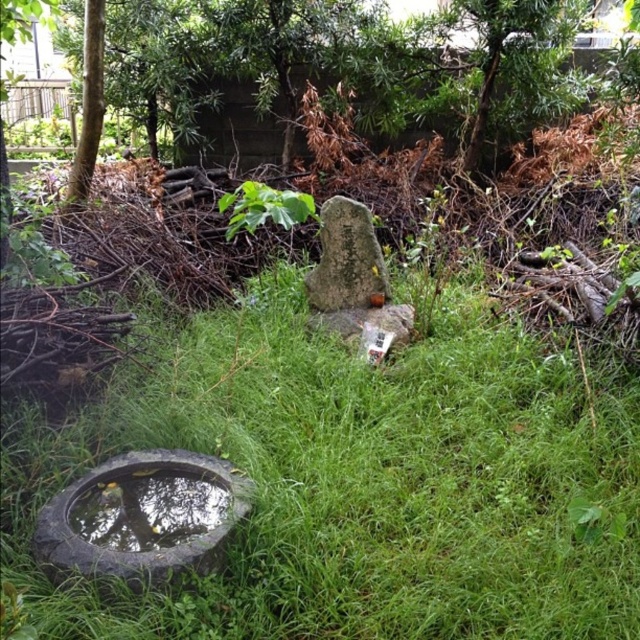
You are standing in the garden and want to place a small decorative stone on the green grass at center. Based on the coordinates provided, where exactly should you place it?

The green grass at center is located at coordinates point (x=364, y=481), so you should place the decorative stone there.

You are a gardener who wants to water the plants around the reflective stone basin at lower left. You have a watering can that can spray water up to 2 meters. Can you reach the basin without moving closer?

The reflective stone basin at lower left is 2.02 meters away from the viewer. Since the watering can can spray up to 2 meters, it cannot reach the basin as it is slightly farther than the maximum range.

You are standing in the garden and want to place a small decoration between the two points marked as point (260, 369) and point (221, 209). Which point should you place it closer to so that it appears larger in the image?

To make the decoration appear larger in the image, you should place it closer to point (260, 369) because it is closer to the viewer than point (221, 209).